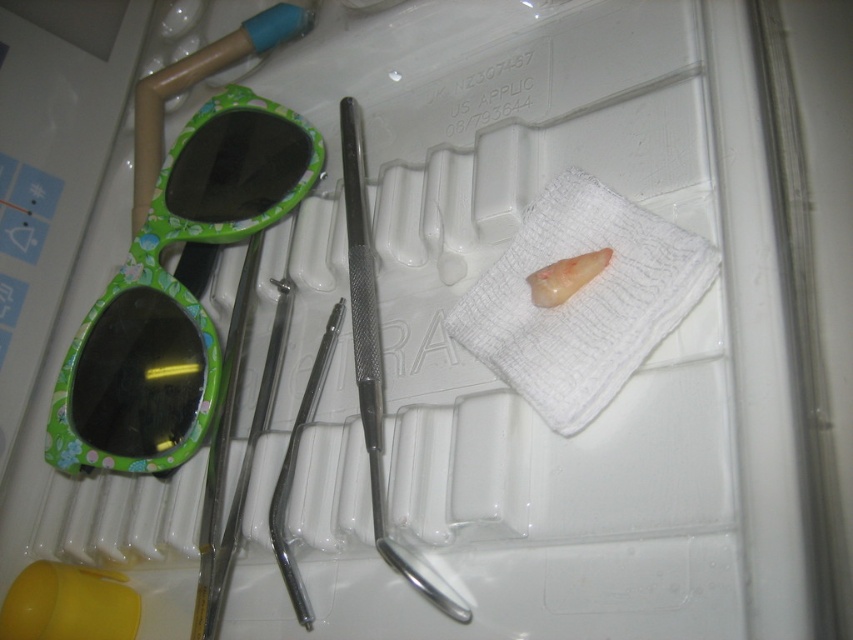
Question: Does white textured cloth at center appear on the right side of translucent rubber tooth at center?

Choices:
 (A) no
 (B) yes

Answer: (B)

Question: Can you confirm if polished metal forceps at center is positioned to the right of translucent rubber tooth at center?

Choices:
 (A) no
 (B) yes

Answer: (A)

Question: Which of the following is the farthest from the observer?

Choices:
 (A) (563, 275)
 (B) (297, 600)
 (C) (648, 326)

Answer: (B)

Question: Estimate the real-world distances between objects in this image. Which object is farther from the polished metal forceps at center?

Choices:
 (A) white textured cloth at center
 (B) translucent rubber tooth at center

Answer: (B)

Question: Can you confirm if white textured cloth at center is bigger than translucent rubber tooth at center?

Choices:
 (A) no
 (B) yes

Answer: (B)

Question: Which point appears closest to the camera in this image?

Choices:
 (A) (320, 342)
 (B) (541, 221)
 (C) (560, 278)

Answer: (C)